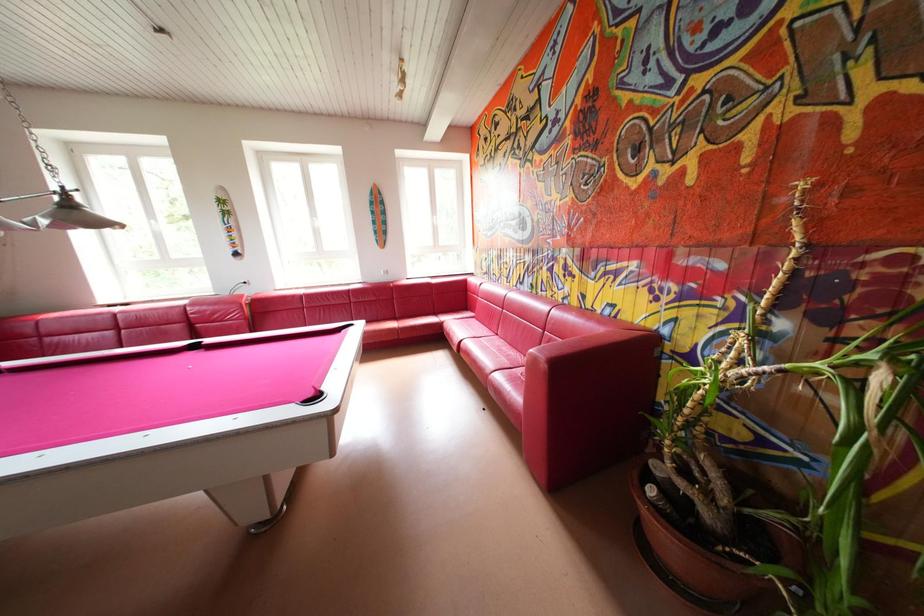
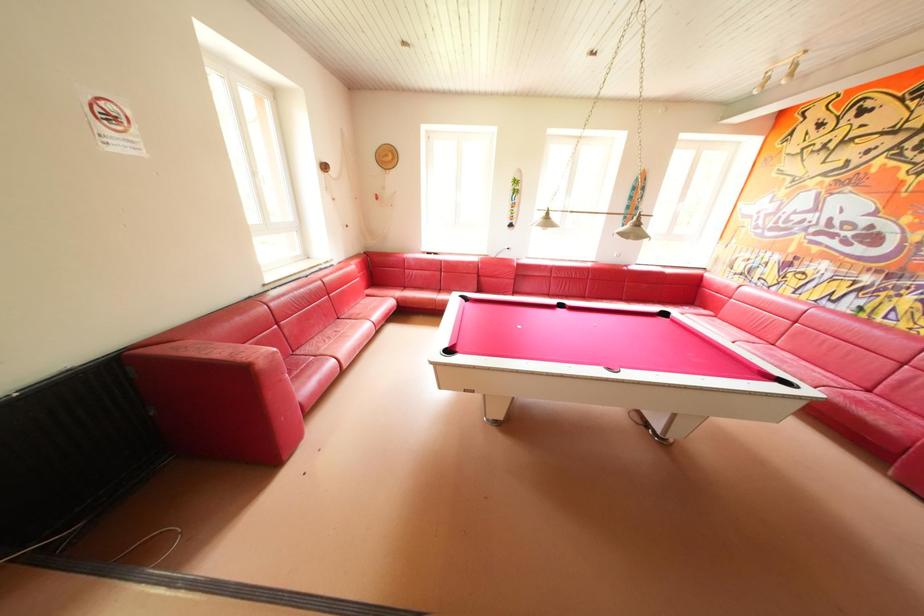
In a continuous first-person perspective shot, in which direction is the camera moving?

The cameraman moved toward left, backward.